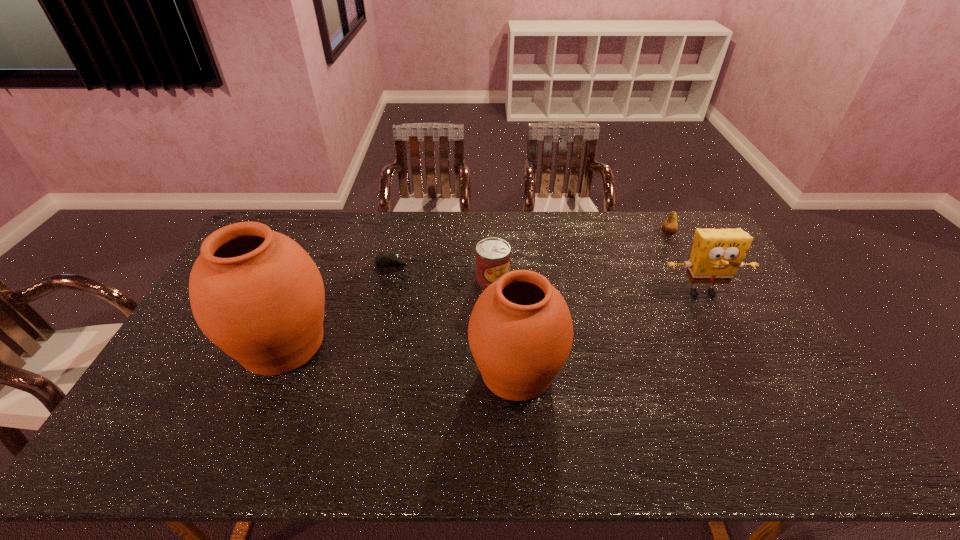
Locate an element on the screen. object at the far right corner is located at coordinates (670, 226).

In the image, there is a desktop. In order to click on vacant space at the far edge in this screenshot , I will do `click(525, 226)`.

In the image, there is a desktop. Where is `vacant space at the near edge`? The height and width of the screenshot is (540, 960). vacant space at the near edge is located at coordinates (275, 417).

Identify the location of vacant space at the left edge of the desktop. Image resolution: width=960 pixels, height=540 pixels. (198, 328).

This screenshot has height=540, width=960. What are the coordinates of `free space at the far left corner of the desktop` in the screenshot? It's located at (287, 228).

Identify the location of vacant space at the near right corner of the desktop. The width and height of the screenshot is (960, 540). (803, 413).

The image size is (960, 540). I want to click on unoccupied area between the tallest object and the second object from left to right, so click(337, 303).

At what (x,y) coordinates should I click in order to perform the action: click on vacant point located between the fifth nearest object and the left urn. Please return your answer as a coordinate pair (x, y). This screenshot has width=960, height=540. Looking at the image, I should click on (337, 303).

Locate an element on the screen. The image size is (960, 540). free spot between the can and the fourth shortest object is located at coordinates (597, 286).

The height and width of the screenshot is (540, 960). In order to click on free space between the taller urn and the can in this screenshot , I will do `click(388, 312)`.